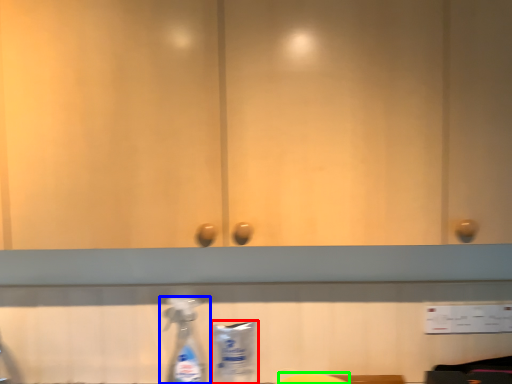
Question: Which object is the closest to the cleaning product (highlighted by a red box)? Choose among these: bottle (highlighted by a blue box) or wide (highlighted by a green box).

Choices:
 (A) bottle
 (B) wide

Answer: (A)